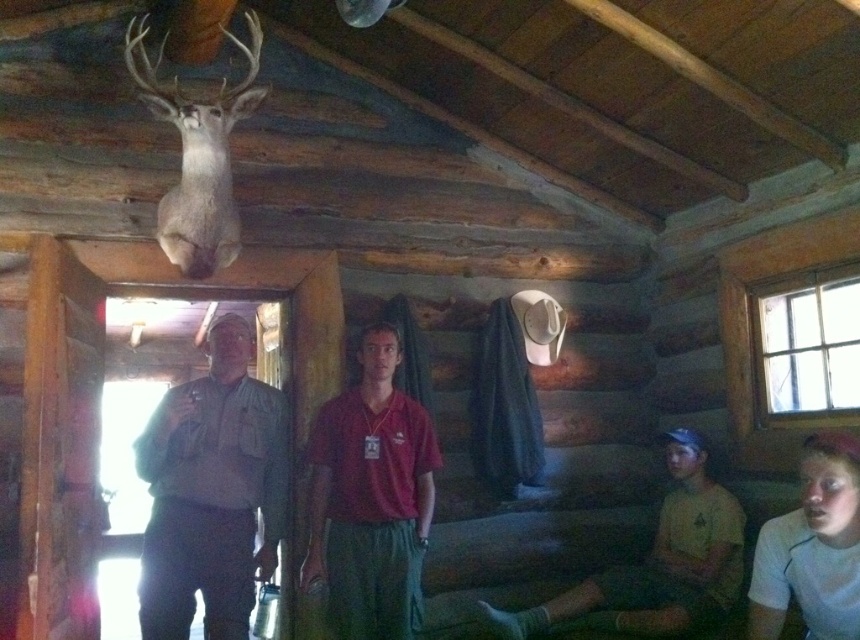
Does matte khaki shirt at center come in front of matte red shirt at center?

No, matte khaki shirt at center is further to the viewer.

At what (x,y) coordinates should I click in order to perform the action: click on matte khaki shirt at center. Please return your answer as a coordinate pair (x, y). The width and height of the screenshot is (860, 640). Looking at the image, I should click on (212, 492).

Which is in front, point (283, 512) or point (390, 531)?

Point (390, 531)

The image size is (860, 640). What are the coordinates of `matte khaki shirt at center` in the screenshot? It's located at (212, 492).

Based on the photo, how much distance is there between matte red shirt at center and yellow-green fabric at lower right?

matte red shirt at center and yellow-green fabric at lower right are 34.28 inches apart from each other.

Measure the distance between point (314, 492) and camera.

They are 8.85 feet apart.

Locate an element on the screen. This screenshot has height=640, width=860. matte red shirt at center is located at coordinates (x=370, y=499).

Describe the element at coordinates (212, 492) in the screenshot. I see `matte khaki shirt at center` at that location.

Is matte khaki shirt at center to the left of yellow-green fabric at lower right from the viewer's perspective?

Indeed, matte khaki shirt at center is positioned on the left side of yellow-green fabric at lower right.

Does point (182, 637) come behind point (596, 596)?

No.

Identify the location of matte khaki shirt at center. The image size is (860, 640). (212, 492).